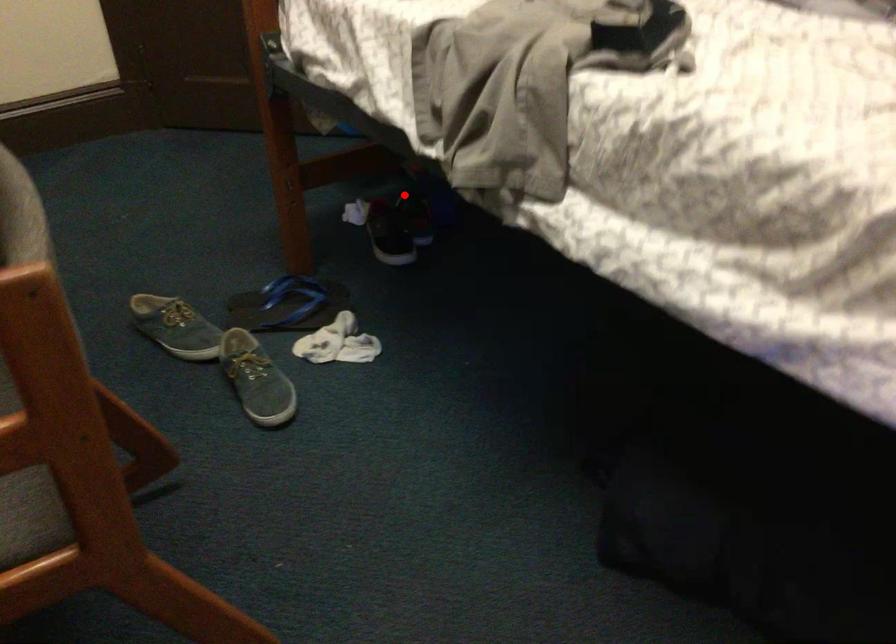
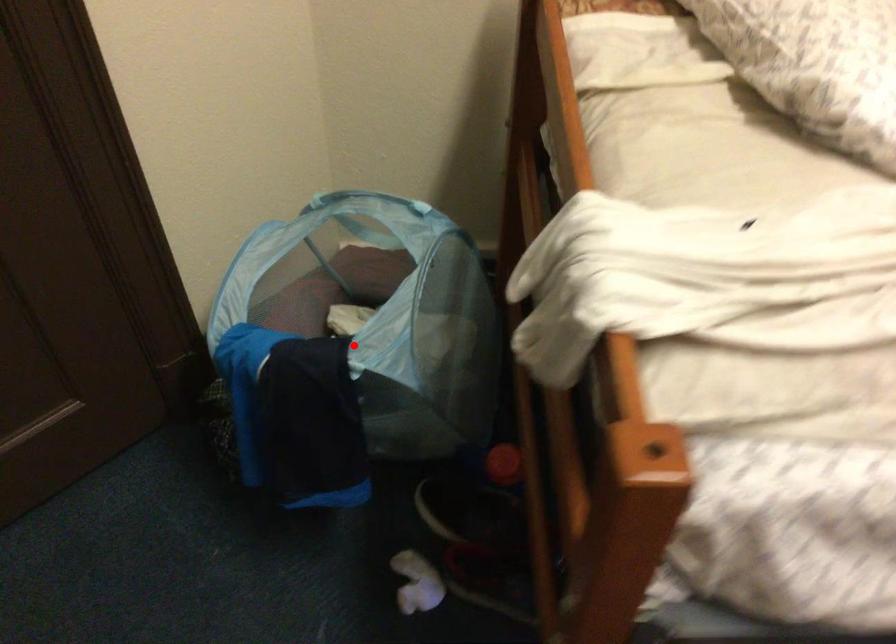
I am providing you with two images of the same scene from different viewpoints. A red point is marked on the first image and another point is marked on the second image. Does the point marked in image1 correspond to the same location as the one in image2?

No